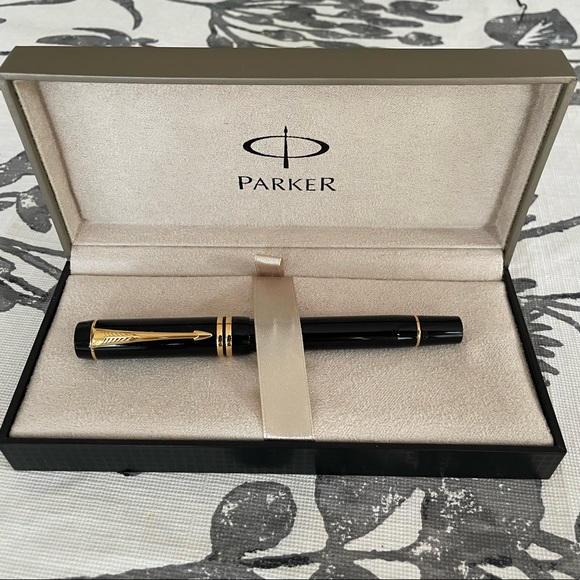
You are a GUI agent. You are given a task and a screenshot of the screen. Output one action in this format:
    pyautogui.click(x=<x>, y=<y>)
    Task: Click on the box
    
    Given the screenshot: What is the action you would take?
    pyautogui.click(x=436, y=72), pyautogui.click(x=430, y=461)